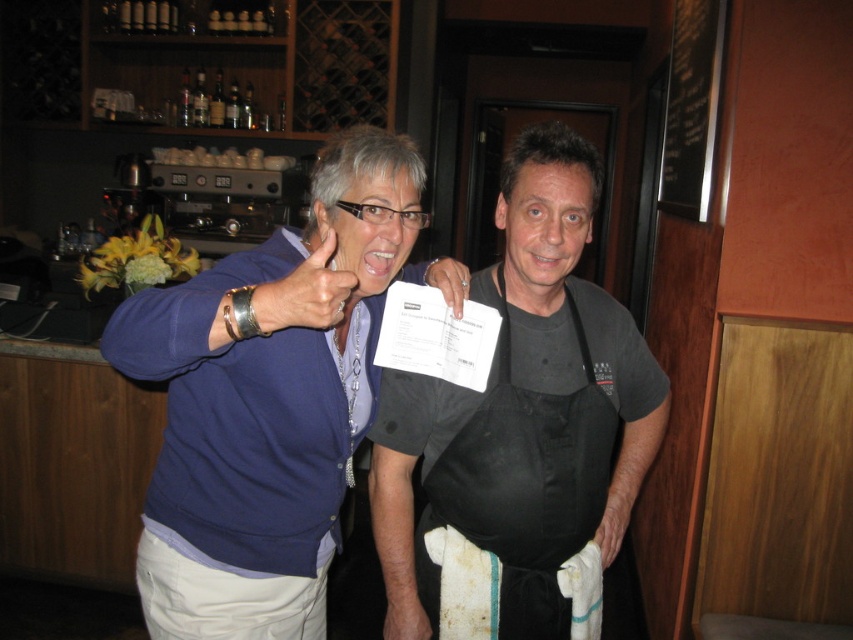
Does black fabric apron at center have a greater height compared to smooth skin hand at center?

Yes.

Can you confirm if black fabric apron at center is thinner than smooth skin hand at center?

Incorrect, black fabric apron at center's width is not less than smooth skin hand at center's.

The image size is (853, 640). What do you see at coordinates (519, 508) in the screenshot?
I see `black fabric apron at center` at bounding box center [519, 508].

This screenshot has width=853, height=640. What are the coordinates of `black fabric apron at center` in the screenshot? It's located at (519, 508).

Does matte gold ring at upper center appear under white matte towel at lower center?

Incorrect, matte gold ring at upper center is not positioned below white matte towel at lower center.

Is point (303, 292) behind point (616, 547)?

No, (303, 292) is closer to viewer.

Does point (328, 294) lie behind point (619, 529)?

No, (328, 294) is in front of (619, 529).

Locate an element on the screen. matte gold ring at upper center is located at coordinates (305, 292).

Which is below, black fabric apron at center or white matte towel at lower center?

white matte towel at lower center is below.

Who is positioned more to the left, black fabric apron at center or white matte towel at lower center?

From the viewer's perspective, black fabric apron at center appears more on the left side.

Does point (426, 474) come farther from viewer compared to point (630, 435)?

No, (426, 474) is closer to viewer.

The width and height of the screenshot is (853, 640). I want to click on black fabric apron at center, so click(519, 508).